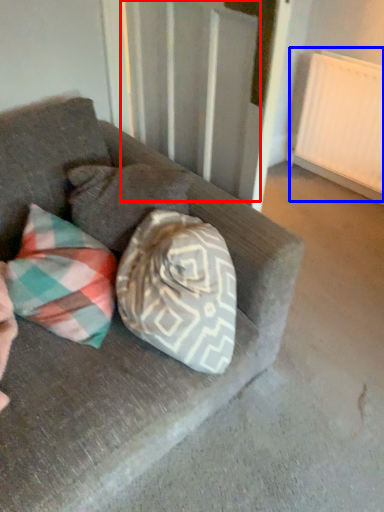
Question: Which object is closer to the camera taking this photo, curtain (highlighted by a red box) or radiator (highlighted by a blue box)?

Choices:
 (A) curtain
 (B) radiator

Answer: (A)